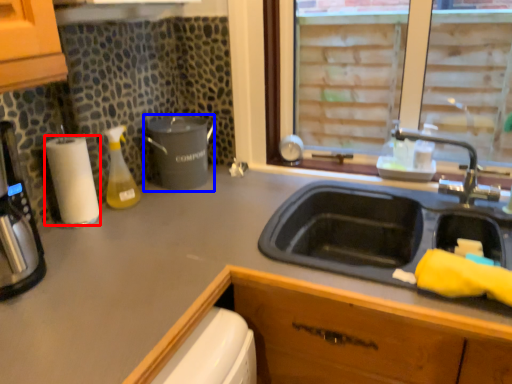
Question: Which of the following is the closest to the observer, paper towel (highlighted by a red box) or appliance (highlighted by a blue box)?

Choices:
 (A) paper towel
 (B) appliance

Answer: (A)